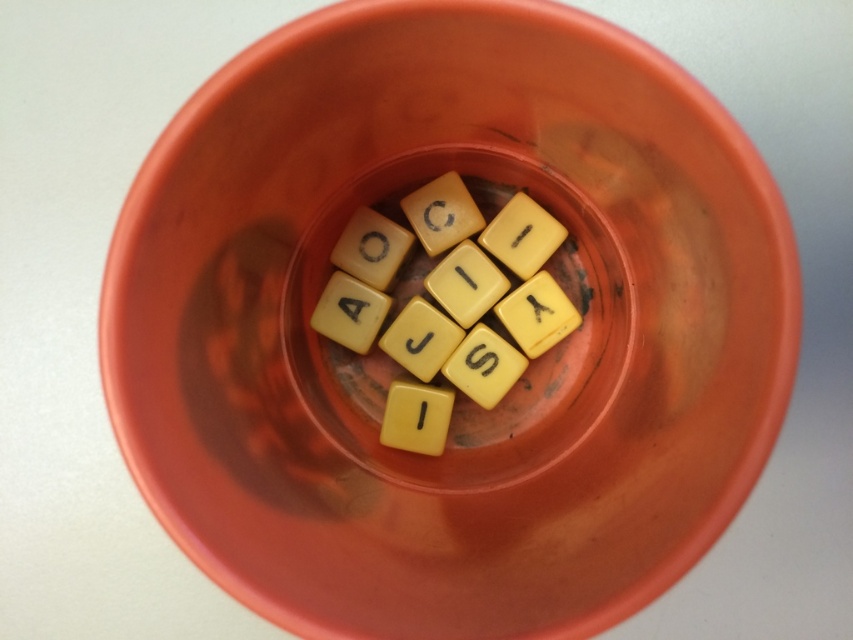
Does yellow matte letter tiles at center appear on the right side of yellow matte letter tile at center?

Correct, you'll find yellow matte letter tiles at center to the right of yellow matte letter tile at center.

Does yellow matte letter tiles at center have a greater height compared to yellow matte letter tile at center?

Yes.

Is point (537, 305) closer to viewer compared to point (370, 332)?

No, (537, 305) is further to viewer.

I want to click on yellow matte letter tiles at center, so coord(450,289).

Between point (408, 442) and point (448, 394), which one is positioned behind?

The point (448, 394) is more distant.

Can you confirm if yellow matte letter tiles at center is thinner than yellow matte letter i at center?

No, yellow matte letter tiles at center is not thinner than yellow matte letter i at center.

Does point (457, 195) come in front of point (395, 397)?

No, (457, 195) is behind (395, 397).

Find the location of a particular element. yellow matte letter tiles at center is located at coordinates (450, 289).

Does yellow matte tile at center lie behind yellow matte letter i at center?

Yes, it is behind yellow matte letter i at center.

The width and height of the screenshot is (853, 640). Describe the element at coordinates (521, 236) in the screenshot. I see `yellow matte tile at center` at that location.

The height and width of the screenshot is (640, 853). I want to click on yellow matte tile at center, so click(x=521, y=236).

What are the coordinates of `yellow matte tile at center` in the screenshot? It's located at (521, 236).